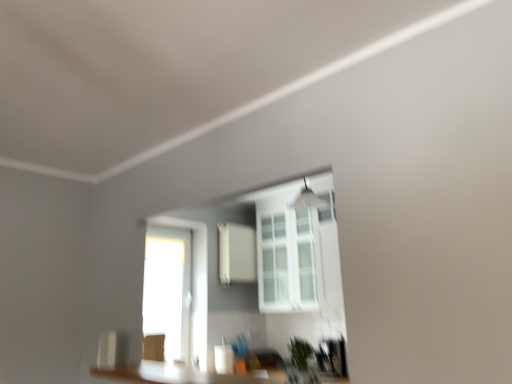
Question: From the image's perspective, is white matte medicine cabinet at center located beneath white glass window at center?

Choices:
 (A) yes
 (B) no

Answer: (A)

Question: From a real-world perspective, is white matte medicine cabinet at center over white glass window at center?

Choices:
 (A) no
 (B) yes

Answer: (B)

Question: Is white matte medicine cabinet at center completely or partially outside of white glass window at center?

Choices:
 (A) yes
 (B) no

Answer: (A)

Question: Is white matte medicine cabinet at center wider than white glass window at center?

Choices:
 (A) yes
 (B) no

Answer: (B)

Question: Could you tell me if white matte medicine cabinet at center is facing white glass window at center?

Choices:
 (A) no
 (B) yes

Answer: (B)

Question: Considering the positions of point (253, 249) and point (295, 304), is point (253, 249) closer or farther from the camera than point (295, 304)?

Choices:
 (A) closer
 (B) farther

Answer: (B)

Question: Is white matte medicine cabinet at center wider or thinner than white glass window at center?

Choices:
 (A) wide
 (B) thin

Answer: (B)

Question: Is white matte medicine cabinet at center situated inside white glass window at center or outside?

Choices:
 (A) outside
 (B) inside

Answer: (A)

Question: From a real-world perspective, is white matte medicine cabinet at center physically located above or below white glass window at center?

Choices:
 (A) below
 (B) above

Answer: (B)

Question: Would you say white glass window at center is to the left or to the right of green matte plant at lower center in the picture?

Choices:
 (A) left
 (B) right

Answer: (B)

Question: From a real-world perspective, relative to green matte plant at lower center, is white glass window at center vertically above or below?

Choices:
 (A) above
 (B) below

Answer: (A)

Question: From the image's perspective, is white glass window at center positioned above or below green matte plant at lower center?

Choices:
 (A) above
 (B) below

Answer: (A)

Question: Which is correct: white glass window at center is inside green matte plant at lower center, or outside of it?

Choices:
 (A) inside
 (B) outside

Answer: (B)

Question: Would you say white matte medicine cabinet at center is inside or outside green matte plant at lower center?

Choices:
 (A) inside
 (B) outside

Answer: (B)

Question: Considering the positions of white matte medicine cabinet at center and green matte plant at lower center in the image, is white matte medicine cabinet at center bigger or smaller than green matte plant at lower center?

Choices:
 (A) small
 (B) big

Answer: (B)